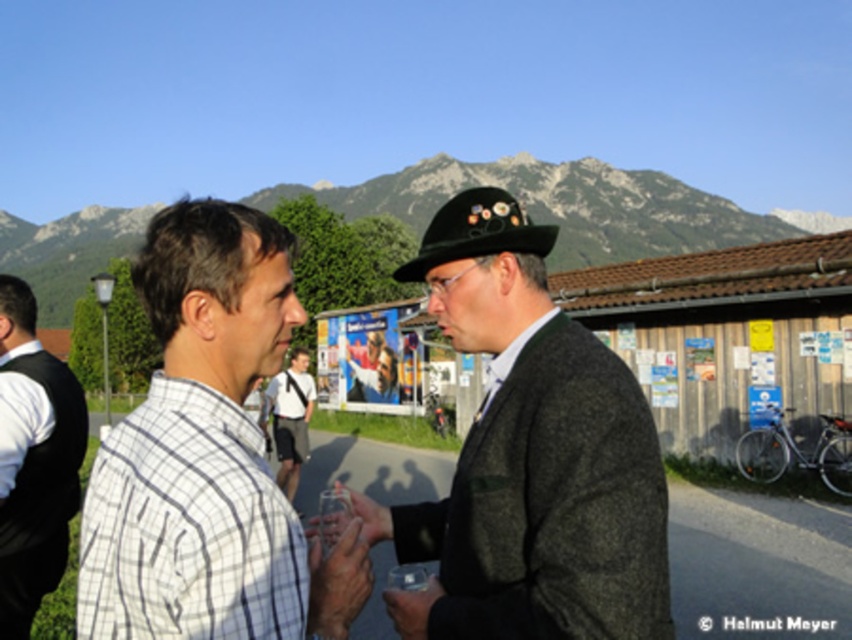
Question: Which object is the closest to the white checkered shirt at left?

Choices:
 (A) white shirt at left
 (B) white cotton shirt at center
 (C) dark gray woolen hat at center

Answer: (C)

Question: Which object is farther from the camera taking this photo?

Choices:
 (A) white shirt at left
 (B) white cotton shirt at center
 (C) white checkered shirt at left
 (D) dark gray woolen hat at center

Answer: (B)

Question: Which of the following is the farthest from the observer?

Choices:
 (A) (619, 566)
 (B) (302, 445)

Answer: (B)

Question: Is white checkered shirt at left positioned before white shirt at left?

Choices:
 (A) no
 (B) yes

Answer: (B)

Question: Is dark gray woolen hat at center above white checkered shirt at left?

Choices:
 (A) yes
 (B) no

Answer: (B)

Question: Can you confirm if white checkered shirt at left is positioned above white shirt at left?

Choices:
 (A) no
 (B) yes

Answer: (B)